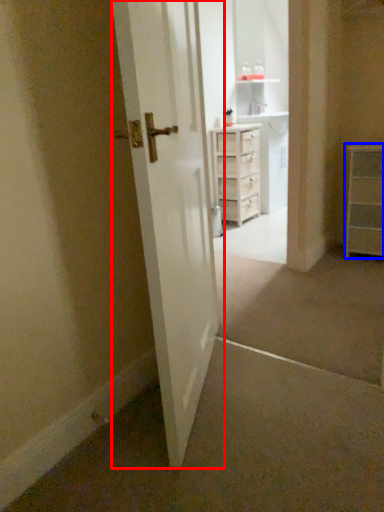
Question: Which of the following is the farthest to the observer, door (highlighted by a red box) or chest of drawers (highlighted by a blue box)?

Choices:
 (A) door
 (B) chest of drawers

Answer: (B)